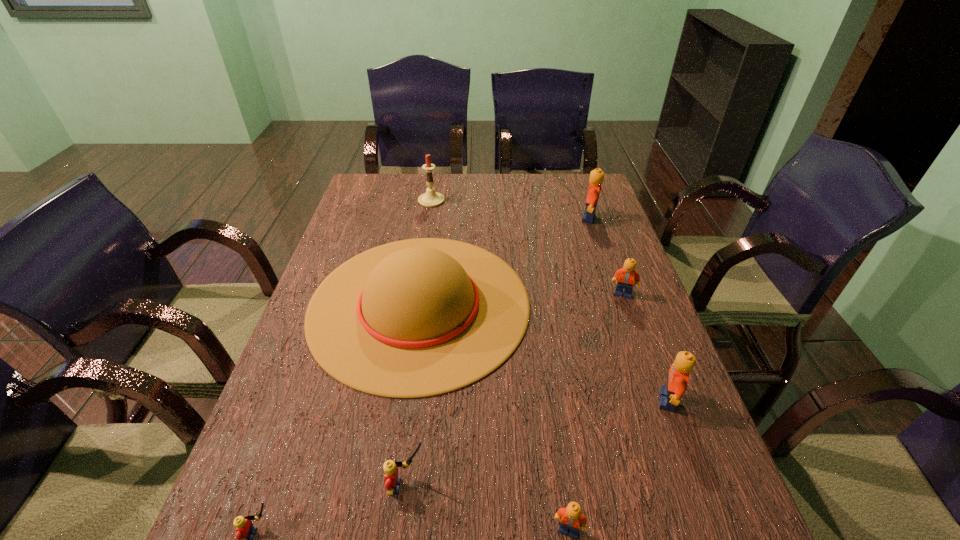
Locate which orange Lego is the second closest to the biggest orange Lego. Please provide its 2D coordinates. Your answer should be formatted as a tuple, i.e. [(x, y)], where the tuple contains the x and y coordinates of a point satisfying the conditions above.

[(678, 376)]

Identify which orange Lego is the second nearest to the candle. Please provide its 2D coordinates. Your answer should be formatted as a tuple, i.e. [(x, y)], where the tuple contains the x and y coordinates of a point satisfying the conditions above.

[(627, 276)]